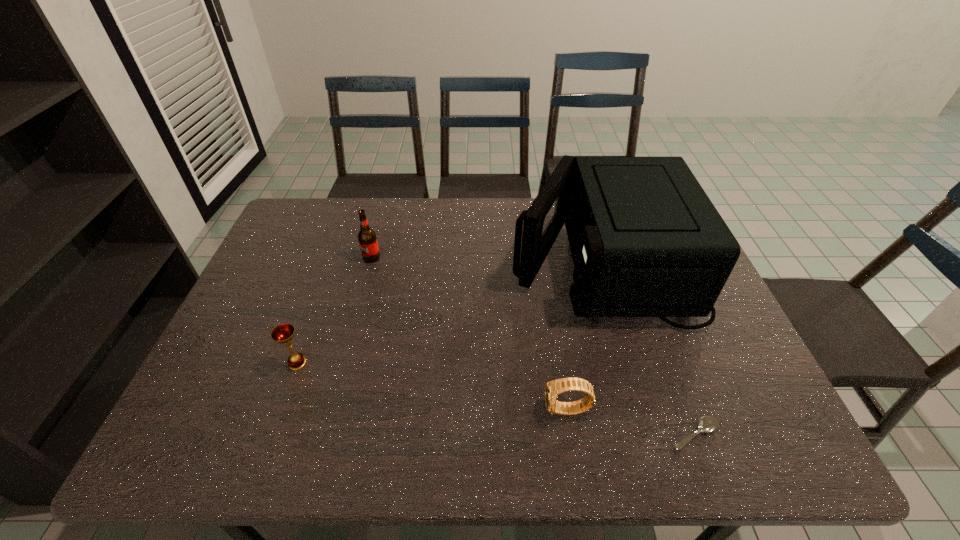
This screenshot has height=540, width=960. I want to click on free space located 0.130m on the left of the fourth shortest object, so click(321, 258).

Find the location of `vacant region located 0.170m on the right of the leftmost object`. vacant region located 0.170m on the right of the leftmost object is located at coordinates (377, 363).

At what (x,y) coordinates should I click in order to perform the action: click on free space located on the face of the watch. Please return your answer as a coordinate pair (x, y). Looking at the image, I should click on (397, 410).

At what (x,y) coordinates should I click in order to perform the action: click on blank area located 0.310m on the face of the watch. Please return your answer as a coordinate pair (x, y). The height and width of the screenshot is (540, 960). Looking at the image, I should click on pyautogui.click(x=406, y=410).

Where is `vacant space located on the face of the watch`? The image size is (960, 540). vacant space located on the face of the watch is located at coordinates coord(495,410).

At what (x,y) coordinates should I click in order to perform the action: click on free space located 0.080m on the left of the soupspoon. Please return your answer as a coordinate pair (x, y). The image size is (960, 540). Looking at the image, I should click on (631, 435).

I want to click on object that is at the far edge, so pos(646,241).

The width and height of the screenshot is (960, 540). I want to click on watch that is positioned at the near edge, so click(x=553, y=388).

Find the location of a particular element. The width and height of the screenshot is (960, 540). soupspoon situated at the near edge is located at coordinates (707, 424).

Locate an element on the screen. This screenshot has height=540, width=960. microwave oven that is at the right edge is located at coordinates (646, 241).